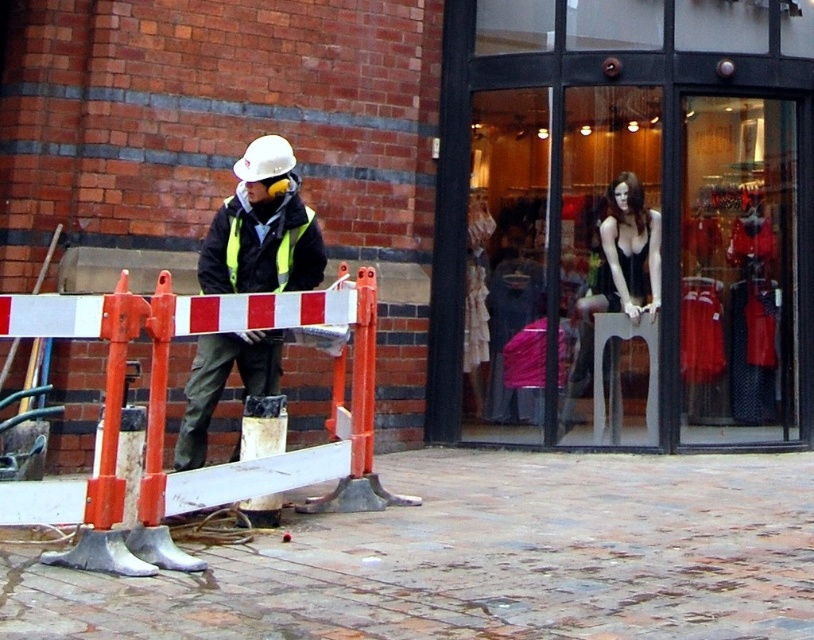
Is clear glass mannequin at center above reflective yellow vest at center?

Yes, clear glass mannequin at center is above reflective yellow vest at center.

Is clear glass mannequin at center bigger than reflective yellow vest at center?

Correct, clear glass mannequin at center is larger in size than reflective yellow vest at center.

Who is more forward, (444, 148) or (206, 369)?

Positioned in front is point (206, 369).

Where is `clear glass mannequin at center`? The height and width of the screenshot is (640, 814). clear glass mannequin at center is located at coordinates (624, 224).

Who is positioned more to the left, reflective yellow vest at center or reflective yellow-green jacket at center?

reflective yellow-green jacket at center is more to the left.

Measure the distance between point (x=283, y=237) and camera.

19.14 feet

Between point (189, 440) and point (239, 234), which one is positioned in front?

Positioned in front is point (189, 440).

Image resolution: width=814 pixels, height=640 pixels. What are the coordinates of `reflective yellow vest at center` in the screenshot? It's located at tap(261, 228).

Is clear glass mannequin at center positioned before reflective yellow-green jacket at center?

No, it is not.

Can you confirm if clear glass mannequin at center is positioned above reflective yellow-green jacket at center?

Yes, clear glass mannequin at center is above reflective yellow-green jacket at center.

Which is behind, point (502, 45) or point (276, 216)?

Positioned behind is point (502, 45).

Where is `clear glass mannequin at center`? This screenshot has height=640, width=814. clear glass mannequin at center is located at coordinates (624, 224).